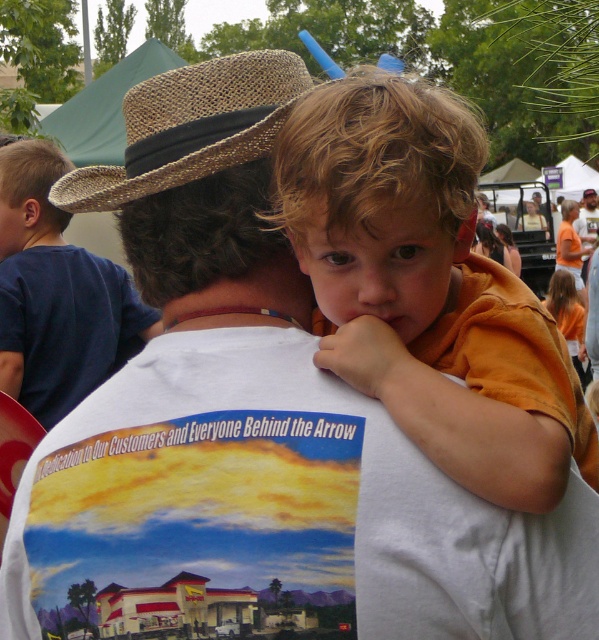
You are standing at the festival and want to take a photo of both the adult and the child. The adult is at point (x=110, y=298) and the child is at point (x=210, y=67). Which point is closer to you so you can focus your camera properly?

Point (x=110, y=298) is closer to you than point (x=210, y=67), so you should focus on that point first.

You are standing in the crowd at the event and want to locate the blue cotton shirt at upper center. Which direction should you look to find it?

You should look towards the upper center direction to find the blue cotton shirt at upper center, as it is located at point (55, 292).

You are a photographer trying to capture a candid shot of the two people in the image. You want to ensure both shirts are visible in the frame. Given that the orange cotton shirt at upper center is narrower than the blue cotton shirt at upper center, which shirt should you focus on to ensure both are fully visible?

The orange cotton shirt at upper center has a lesser width compared to the blue cotton shirt at upper center, so focusing on the wider blue cotton shirt at upper center would ensure both shirts are fully visible in the frame.